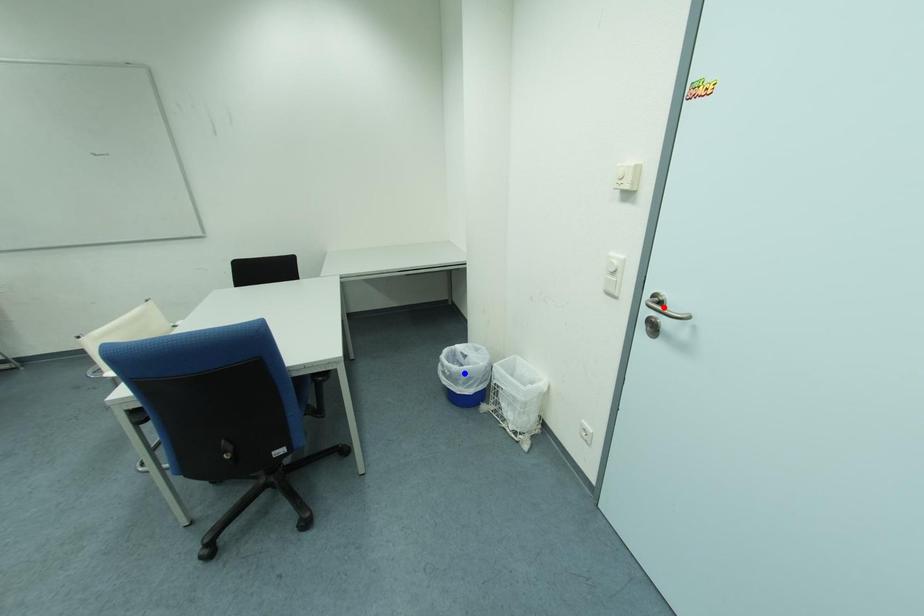
Question: Two points are marked on the image. Which point is closer to the camera?

Choices:
 (A) Blue point is closer.
 (B) Red point is closer.

Answer: (B)